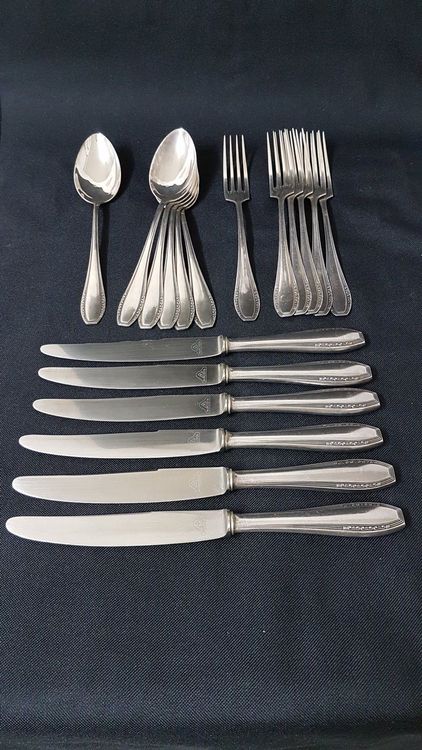
What are the coordinates of `knives` in the screenshot? It's located at (170, 522), (164, 489), (164, 450), (168, 412), (168, 381), (159, 348).